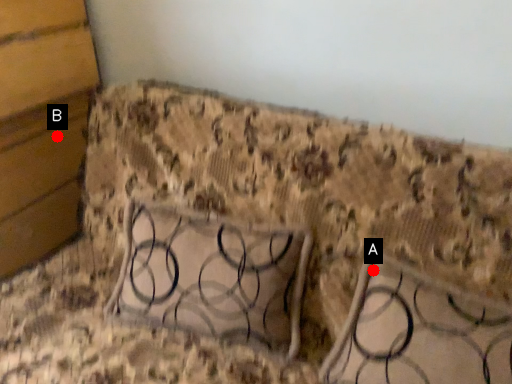
Question: Two points are circled on the image, labeled by A and B beside each circle. Which point is closer to the camera taking this photo?

Choices:
 (A) A is closer
 (B) B is closer

Answer: (A)